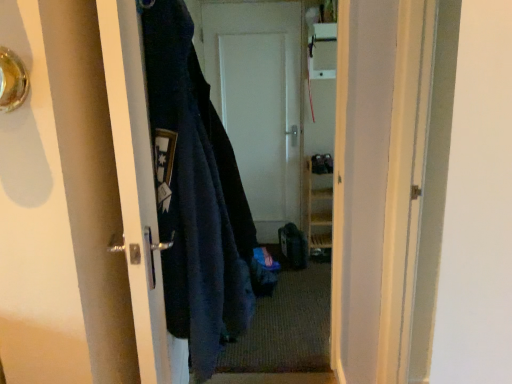
Locate an element on the screen. white matte door at center, the second door from the left is located at coordinates (259, 101).

Describe the element at coordinates (197, 197) in the screenshot. I see `dark blue fuzzy jacket at left` at that location.

Identify the location of matte black door handle at left, which is counted as the second door, starting from the back. (138, 192).

What are the coordinates of `metallic silver door handle at upper left` in the screenshot? It's located at (12, 80).

Who is taller, matte black door handle at left, which is counted as the second door, starting from the back, or metallic silver door handle at upper left?

Standing taller between the two is matte black door handle at left, which is counted as the second door, starting from the back.

Is matte black door handle at left, the 1th door when ordered from front to back, facing away from metallic silver door handle at upper left?

Absolutely, matte black door handle at left, the 1th door when ordered from front to back, is directed away from metallic silver door handle at upper left.

Where is `the 1st door behind the metallic silver door handle at upper left, starting your count from the anchor`? the 1st door behind the metallic silver door handle at upper left, starting your count from the anchor is located at coordinates (138, 192).

Which door is the 2nd one when counting from the left side of the carpeted mat at center? Please provide its 2D coordinates.

[(138, 192)]

Is matte black door handle at left, which is the first door from left to right, facing towards carpeted mat at center?

No, matte black door handle at left, which is the first door from left to right, is not oriented towards carpeted mat at center.

Which of these two, matte black door handle at left, the 1th door when ordered from front to back, or carpeted mat at center, is wider?

carpeted mat at center.

Which of these two, metallic silver door handle at upper left or matte black door handle at left, which is counted as the second door, starting from the back, is smaller?

metallic silver door handle at upper left is smaller.

Is metallic silver door handle at upper left thinner than matte black door handle at left, the 2th door viewed from the right?

Indeed, metallic silver door handle at upper left has a lesser width compared to matte black door handle at left, the 2th door viewed from the right.

Starting from the metallic silver door handle at upper left, which door is the 1st one behind? Please provide its 2D coordinates.

[(138, 192)]

From the image's perspective, which one is positioned higher, metallic silver door handle at upper left or matte black door handle at left, the 2th door viewed from the right?

metallic silver door handle at upper left, from the image's perspective.

Is metallic silver door handle at upper left thinner than white matte door at center, the 2th door when ordered from front to back?

In fact, metallic silver door handle at upper left might be wider than white matte door at center, the 2th door when ordered from front to back.

Does metallic silver door handle at upper left turn towards white matte door at center, the second door from the left?

No, metallic silver door handle at upper left is not aimed at white matte door at center, the second door from the left.

Based on the photo, visually, is metallic silver door handle at upper left positioned to the left or to the right of white matte door at center, the first door viewed from the back?

Clearly, metallic silver door handle at upper left is on the left of white matte door at center, the first door viewed from the back, in the image.

From a real-world perspective, is metallic silver door handle at upper left located beneath white matte door at center, the first door viewed from the back?

No.

From a real-world perspective, does carpeted mat at center stand above dark blue fuzzy jacket at left?

No, from a real-world perspective, carpeted mat at center is not on top of dark blue fuzzy jacket at left.

In the image, is carpeted mat at center on the left side or the right side of dark blue fuzzy jacket at left?

In the image, carpeted mat at center appears on the right side of dark blue fuzzy jacket at left.

Is carpeted mat at center oriented towards dark blue fuzzy jacket at left?

No.

Which object is positioned more to the left, white matte door at center, the 2th door when ordered from front to back, or dark blue fuzzy jacket at left?

dark blue fuzzy jacket at left.

Is white matte door at center, the first door in the right-to-left sequence, taller than dark blue fuzzy jacket at left?

Yes.

Find the location of a particular element. This screenshot has height=384, width=512. garment that appears above the white matte door at center, the second door from the left (from a real-world perspective) is located at coordinates (197, 197).

Between point (209, 83) and point (210, 302), which one is positioned in front?

Positioned in front is point (210, 302).

From the image's perspective, which object appears higher, carpeted mat at center or white matte door at center, the first door viewed from the back?

From the image's view, white matte door at center, the first door viewed from the back, is above.

From a real-world perspective, is carpeted mat at center under white matte door at center, the second door from the left?

Correct, in the physical world, carpeted mat at center is lower than white matte door at center, the second door from the left.

Considering the sizes of objects carpeted mat at center and white matte door at center, the second door from the left, in the image provided, who is thinner, carpeted mat at center or white matte door at center, the second door from the left,?

white matte door at center, the second door from the left.

Locate an element on the screen. The image size is (512, 384). door handle in front of the matte black door handle at left, which is the first door from left to right is located at coordinates (12, 80).

This screenshot has width=512, height=384. In order to click on doormat on the right of matte black door handle at left, the 2th door viewed from the right in this screenshot , I will do [286, 326].

Estimate the real-world distances between objects in this image. Which object is further from metallic silver door handle at upper left, carpeted mat at center or matte black door handle at left, the 1th door when ordered from front to back?

The object further to metallic silver door handle at upper left is carpeted mat at center.

Looking at the image, which one is located closer to metallic silver door handle at upper left, white matte door at center, the first door viewed from the back, or carpeted mat at center?

carpeted mat at center is positioned closer to the anchor metallic silver door handle at upper left.

Which object lies further to the anchor point matte black door handle at left, which is the first door from left to right, white matte door at center, the second door from the left, or carpeted mat at center?

The object further to matte black door handle at left, which is the first door from left to right, is white matte door at center, the second door from the left.

Estimate the real-world distances between objects in this image. Which object is closer to matte black door handle at left, the 1th door when ordered from front to back, white matte door at center, the second door from the left, or metallic silver door handle at upper left?

metallic silver door handle at upper left lies closer to matte black door handle at left, the 1th door when ordered from front to back, than the other object.

In the scene shown: Based on their spatial positions, is carpeted mat at center or dark blue fuzzy jacket at left further from white matte door at center, the 2th door when ordered from front to back?

dark blue fuzzy jacket at left is positioned further to the anchor white matte door at center, the 2th door when ordered from front to back.

When comparing their distances from white matte door at center, the second door from the left, does matte black door handle at left, the 1th door when ordered from front to back, or metallic silver door handle at upper left seem further?

metallic silver door handle at upper left is positioned further to the anchor white matte door at center, the second door from the left.

Consider the image. Which object lies nearer to the anchor point carpeted mat at center, white matte door at center, the first door in the right-to-left sequence, or matte black door handle at left, which is the first door from left to right?

Among the two, white matte door at center, the first door in the right-to-left sequence, is located nearer to carpeted mat at center.

Looking at the image, which one is located closer to white matte door at center, the second door from the left, dark blue fuzzy jacket at left or matte black door handle at left, which is the first door from left to right?

dark blue fuzzy jacket at left lies closer to white matte door at center, the second door from the left, than the other object.

This screenshot has width=512, height=384. I want to click on doormat located between metallic silver door handle at upper left and white matte door at center, the first door viewed from the back, in the depth direction, so click(x=286, y=326).

Identify the location of door situated between metallic silver door handle at upper left and dark blue fuzzy jacket at left from left to right. The height and width of the screenshot is (384, 512). pyautogui.click(x=138, y=192).

In order to click on door located between metallic silver door handle at upper left and white matte door at center, the 2th door when ordered from front to back, in the depth direction in this screenshot , I will do `click(138, 192)`.

Locate an element on the screen. The width and height of the screenshot is (512, 384). garment between matte black door handle at left, which is counted as the second door, starting from the back, and white matte door at center, the first door viewed from the back, in the front-back direction is located at coordinates (197, 197).